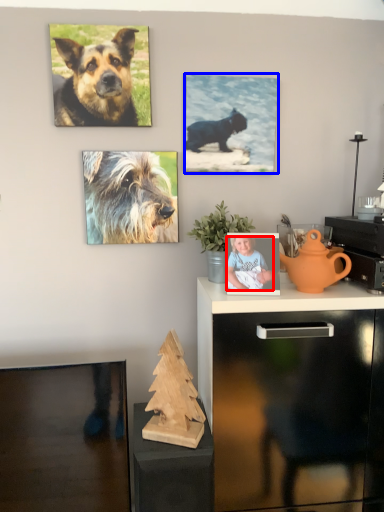
Question: Which point is further to the camera, person (highlighted by a red box) or picture frame (highlighted by a blue box)?

Choices:
 (A) person
 (B) picture frame

Answer: (B)